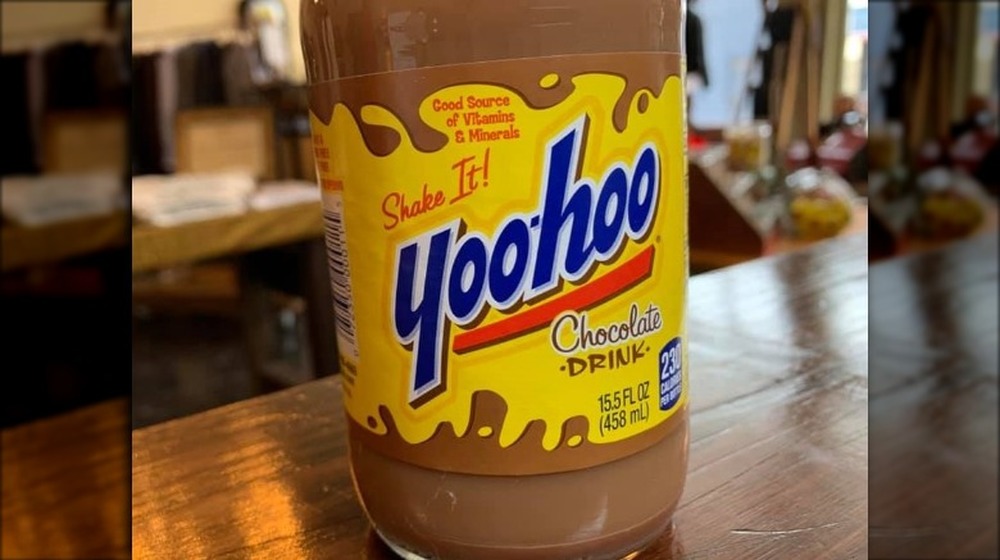
Where is `curtain`? This screenshot has width=1000, height=560. curtain is located at coordinates (789, 68).